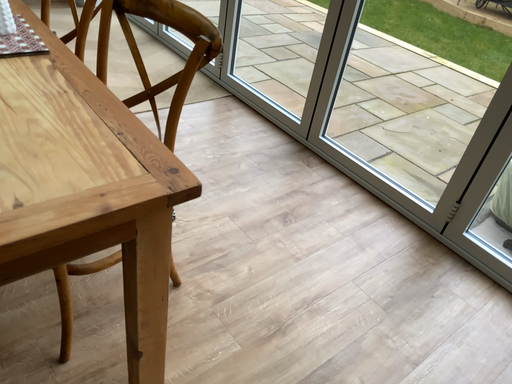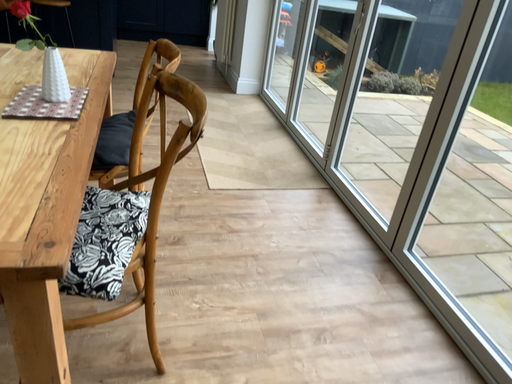
Question: Which way did the camera rotate in the video?

Choices:
 (A) rotated upward
 (B) rotated downward

Answer: (A)